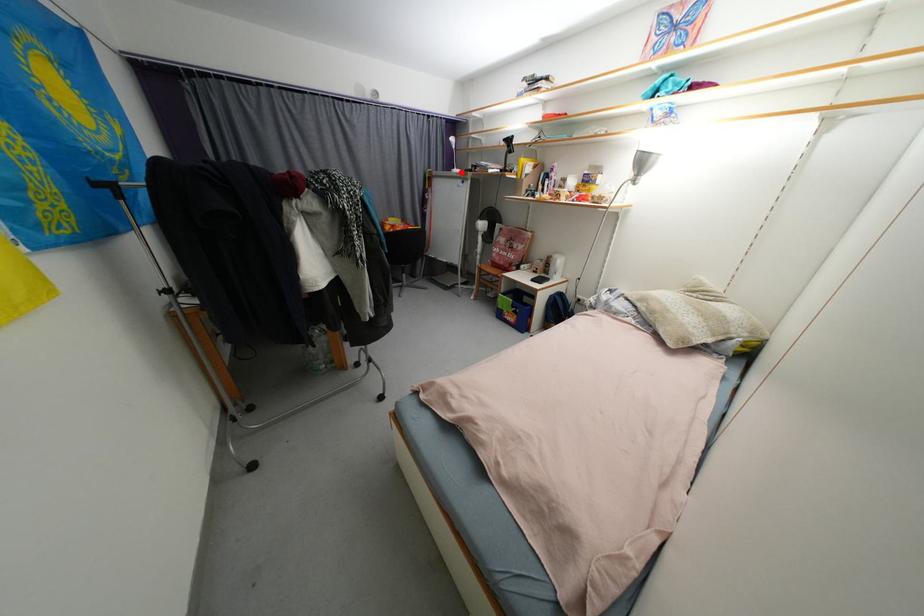
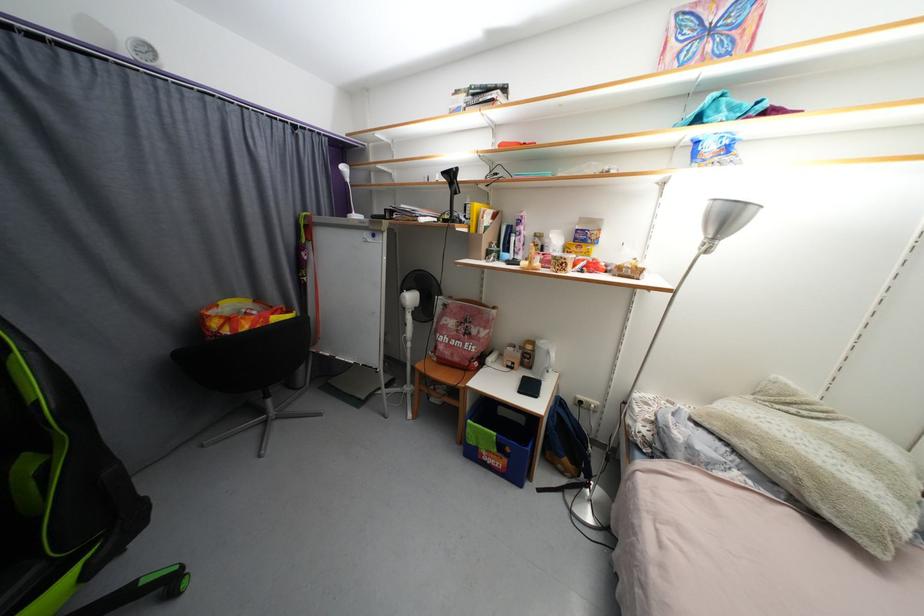
Question: I am providing you with two images of the same scene from different viewpoints. In image1, a red point is highlighted. Considering the same 3D point in image2, which of the following is correct?

Choices:
 (A) It is closer
 (B) It is farther

Answer: (B)